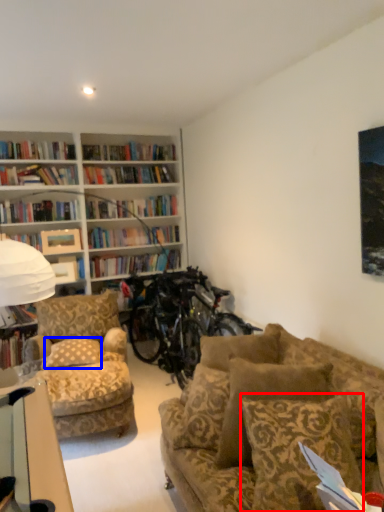
Question: Which object appears farthest to the camera in this image, pillow (highlighted by a red box) or pillow (highlighted by a blue box)?

Choices:
 (A) pillow
 (B) pillow

Answer: (B)